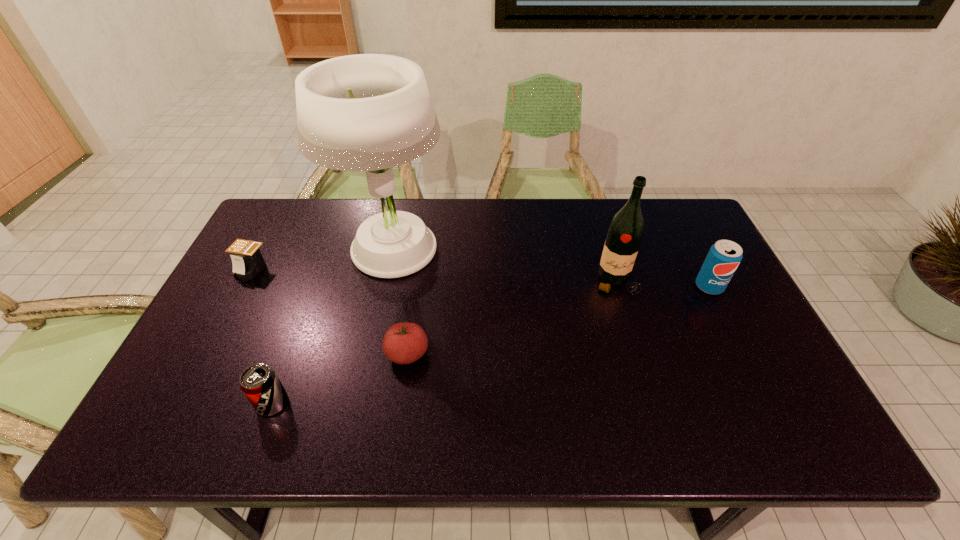
Locate an element on the screen. This screenshot has width=960, height=540. lamp is located at coordinates (366, 112).

This screenshot has width=960, height=540. In order to click on the second tallest object in this screenshot , I will do coord(625,232).

Locate an element on the screen. The height and width of the screenshot is (540, 960). the fifth object from left to right is located at coordinates (625, 232).

Locate an element on the screen. Image resolution: width=960 pixels, height=540 pixels. the taller soda can is located at coordinates (723, 258).

Where is `the farther soda can`? The height and width of the screenshot is (540, 960). the farther soda can is located at coordinates (723, 258).

You are a GUI agent. You are given a task and a screenshot of the screen. Output one action in this format:
    pyautogui.click(x=<x>, y=<y>)
    Task: Click on the shorter soda can
    Image resolution: width=960 pixels, height=540 pixels.
    Given the screenshot: What is the action you would take?
    pyautogui.click(x=259, y=382)

At what (x,y) coordinates should I click in order to perform the action: click on the nearer soda can. Please return your answer as a coordinate pair (x, y). Looking at the image, I should click on (259, 382).

Where is `tomato`? Image resolution: width=960 pixels, height=540 pixels. tomato is located at coordinates (404, 343).

In order to click on the shortest object in this screenshot , I will do `click(247, 259)`.

Where is `the leftmost object`? This screenshot has width=960, height=540. the leftmost object is located at coordinates (247, 259).